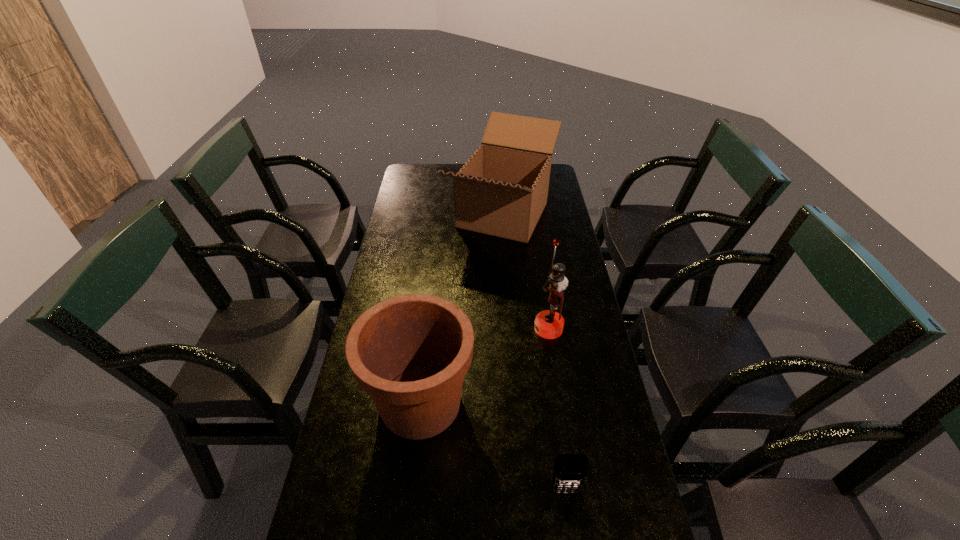
Where is `the second farthest object`? Image resolution: width=960 pixels, height=540 pixels. the second farthest object is located at coordinates (549, 324).

Where is `the farthest object`? The height and width of the screenshot is (540, 960). the farthest object is located at coordinates (502, 190).

Locate an element on the screen. the second nearest object is located at coordinates (410, 353).

I want to click on flowerpot, so click(410, 353).

Find the location of `cellular telephone`. cellular telephone is located at coordinates (570, 470).

In order to click on the shortest object in this screenshot , I will do `click(570, 470)`.

At what (x,y) coordinates should I click in order to perform the action: click on free space located on the front-facing side of the third nearest object. Please return your answer as a coordinate pair (x, y). The width and height of the screenshot is (960, 540). Looking at the image, I should click on (444, 328).

At what (x,y) coordinates should I click in order to perform the action: click on free space located on the front-facing side of the third nearest object. Please return your answer as a coordinate pair (x, y). The height and width of the screenshot is (540, 960). Looking at the image, I should click on (409, 328).

I want to click on vacant space located 0.150m on the front-facing side of the third nearest object, so click(487, 328).

Find the location of a particular element. Image resolution: width=960 pixels, height=540 pixels. free point located 0.200m on the left of the box is located at coordinates (399, 215).